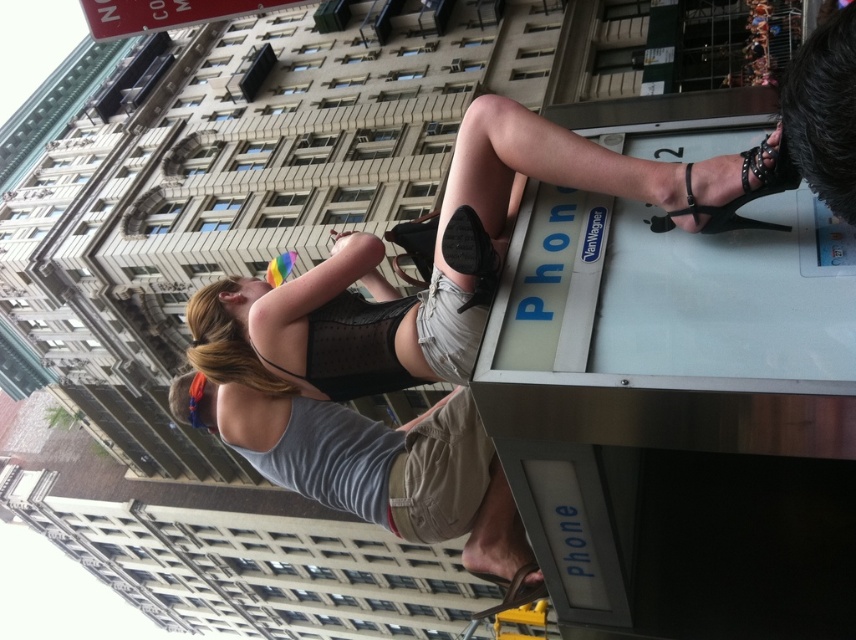
From the picture: Can you confirm if matte black high-heeled shoe at upper right is thinner than black leather sandal at upper right?

In fact, matte black high-heeled shoe at upper right might be wider than black leather sandal at upper right.

Between matte black high-heeled shoe at upper right and black leather sandal at upper right, which one appears on the left side from the viewer's perspective?

Positioned to the left is matte black high-heeled shoe at upper right.

What are the coordinates of `matte black high-heeled shoe at upper right` in the screenshot? It's located at (450, 260).

Who is shorter, black leather sandal at upper right or brown leather sandal at lower center?

black leather sandal at upper right

Describe the element at coordinates (739, 195) in the screenshot. I see `black leather sandal at upper right` at that location.

Identify the location of black leather sandal at upper right. The width and height of the screenshot is (856, 640). (739, 195).

Does matte black high-heeled shoe at upper right appear over brown leather sandal at lower center?

Correct, matte black high-heeled shoe at upper right is located above brown leather sandal at lower center.

Can you confirm if matte black high-heeled shoe at upper right is taller than brown leather sandal at lower center?

Yes.

The width and height of the screenshot is (856, 640). I want to click on matte black high-heeled shoe at upper right, so click(450, 260).